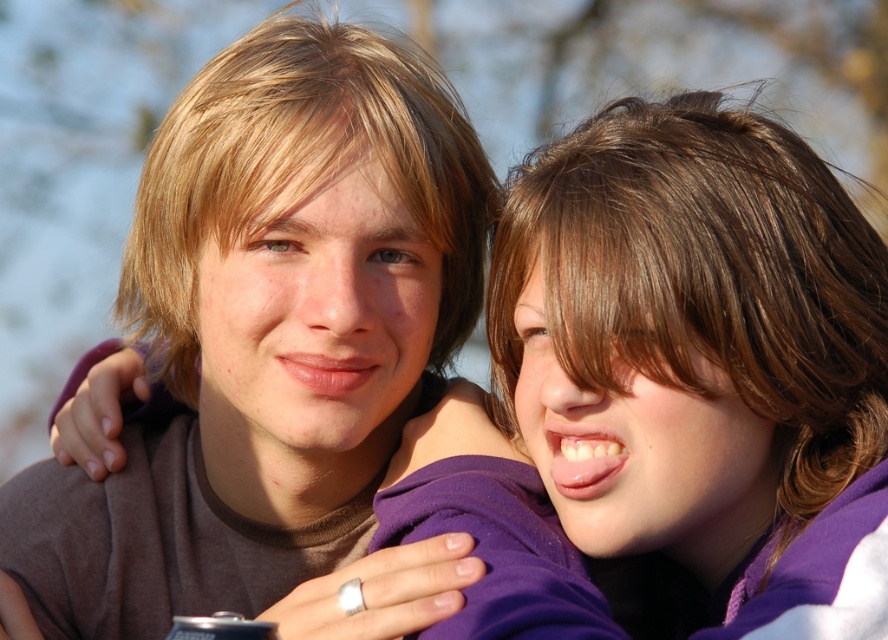
You are a photographer trying to adjust the focus of your camera. The matte brown hair at center and the purple fabric at upper right are both in the frame. Given that the camera can only focus on objects within a 10 inch range, will both objects remain in focus?

The matte brown hair at center is 10.10 inches away from the purple fabric at upper right. Since the distance between them is slightly over 10 inches, the camera might not keep both in focus simultaneously.

You are a photographer trying to capture a closeup shot of the matte brown hair at center and the purple fabric at upper right. Which object should you zoom in on to ensure both are in frame without moving the camera?

You should zoom in on the purple fabric at upper right because it is smaller in width compared to the matte brown hair at center, allowing both to fit within the frame when focusing on the narrower object.